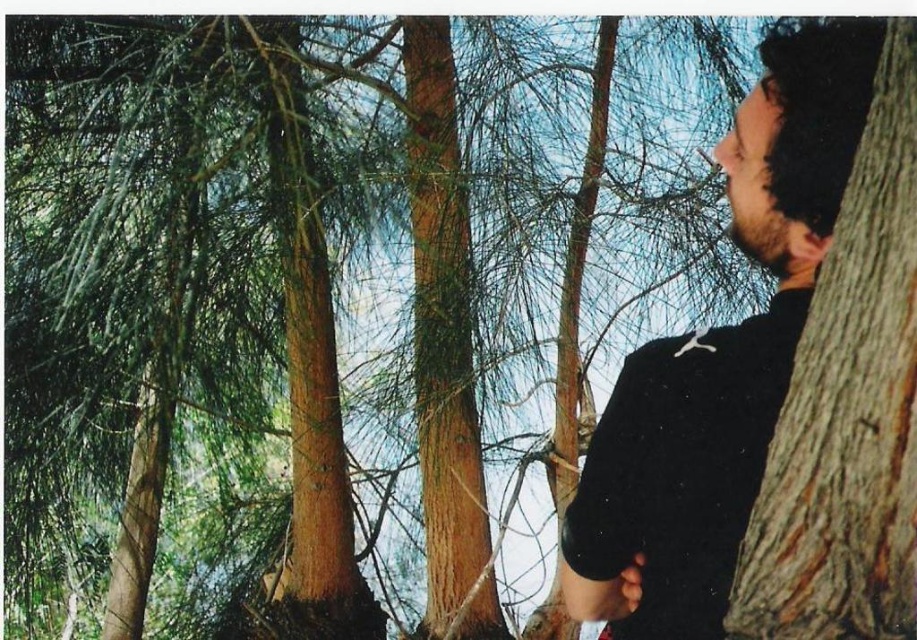
You are an observer standing in front of the scene. You notice the black matte shirt at right and the brown rough tree trunk at center. Which object is shorter in height?

The black matte shirt at right is not as tall as the brown rough tree trunk at center, so the black matte shirt at right is shorter.

You are a photographer trying to capture the scene with a wide angle lens. You notice the black matte shirt at right and the brown rough tree trunk at center. Which object would appear wider in your photo?

The black matte shirt at right appears wider than the brown rough tree trunk at center in the photo because its width is larger.